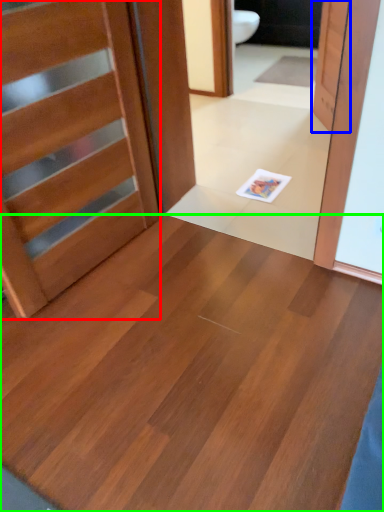
Question: Which object is the closest to the door (highlighted by a red box)? Choose among these: door (highlighted by a blue box) or plywood (highlighted by a green box).

Choices:
 (A) door
 (B) plywood

Answer: (B)